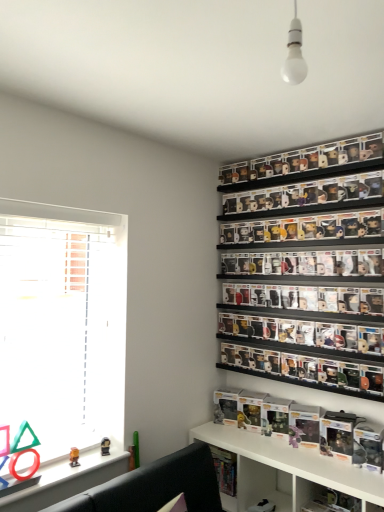
Question: Visually, is white glossy bulb at upper center positioned to the left or to the right of matte orange toy at lower left?

Choices:
 (A) right
 (B) left

Answer: (A)

Question: From a real-world perspective, is white glossy bulb at upper center physically located above or below matte orange toy at lower left?

Choices:
 (A) below
 (B) above

Answer: (B)

Question: Estimate the real-world distances between objects in this image. Which object is farther from the hardcover book at lower center?

Choices:
 (A) black plastic shelf at center, which is the 3th shelf from top to bottom
 (B) white glossy cabinet at lower right
 (C) black matte pop vinyl figures at center, placed as the 3th shelf when sorted from bottom to top
 (D) white glossy bulb at upper center
 (E) matte orange toy at lower left

Answer: (D)

Question: Which object is the closest to the white glossy cabinet at lower right?

Choices:
 (A) black plastic shelf at center, the second shelf when ordered from bottom to top
 (B) clear plastic figures at upper right, which is counted as the 4th shelf, starting from the bottom
 (C) white glossy shelf at lower center, the first shelf positioned from the bottom
 (D) white matte window at left
 (E) hardcover book at lower center

Answer: (C)